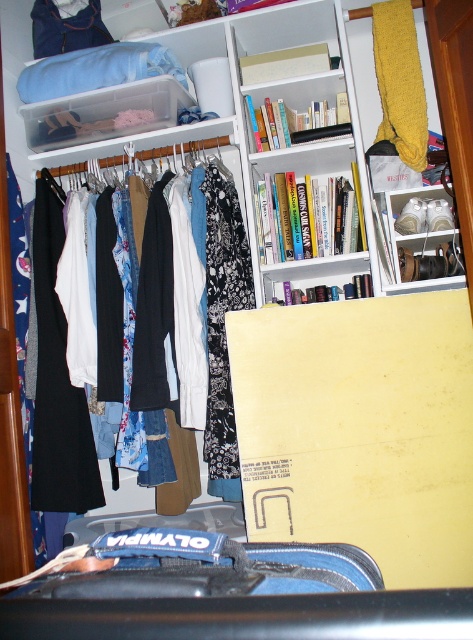
Can you confirm if white cotton shirt at center is bigger than white plastic shoe at upper right?

Indeed, white cotton shirt at center has a larger size compared to white plastic shoe at upper right.

Where is `white cotton shirt at center`? The height and width of the screenshot is (640, 473). white cotton shirt at center is located at coordinates (175, 496).

Is hardcover books at upper center positioned before white fabric hanger at center?

Yes, it is in front of white fabric hanger at center.

Looking at this image, who is taller, hardcover books at upper center or white fabric hanger at center?

With more height is hardcover books at upper center.

This screenshot has height=640, width=473. What do you see at coordinates (295, 120) in the screenshot? I see `hardcover books at upper center` at bounding box center [295, 120].

Locate an element on the screen. hardcover books at upper center is located at coordinates pyautogui.click(x=295, y=120).

Is white cotton shirt at center wider than yellow knitted scarf at upper right?

Indeed, white cotton shirt at center has a greater width compared to yellow knitted scarf at upper right.

Consider the image. Does white cotton shirt at center have a lesser height compared to yellow knitted scarf at upper right?

Incorrect, white cotton shirt at center's height does not fall short of yellow knitted scarf at upper right's.

Which is behind, point (31, 220) or point (395, 115)?

Positioned behind is point (31, 220).

In order to click on white cotton shirt at center in this screenshot , I will do `click(175, 496)`.